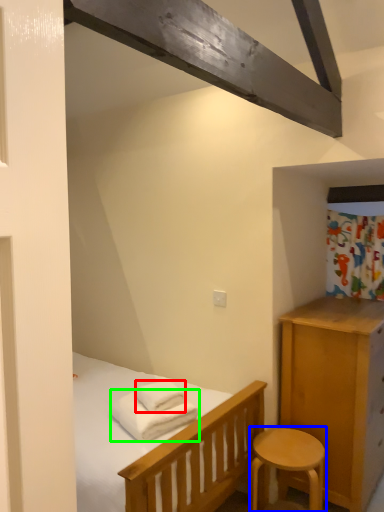
Question: Which is farther away from bath towel (highlighted by a red box)? stool (highlighted by a blue box) or bath towel (highlighted by a green box)?

Choices:
 (A) stool
 (B) bath towel

Answer: (A)